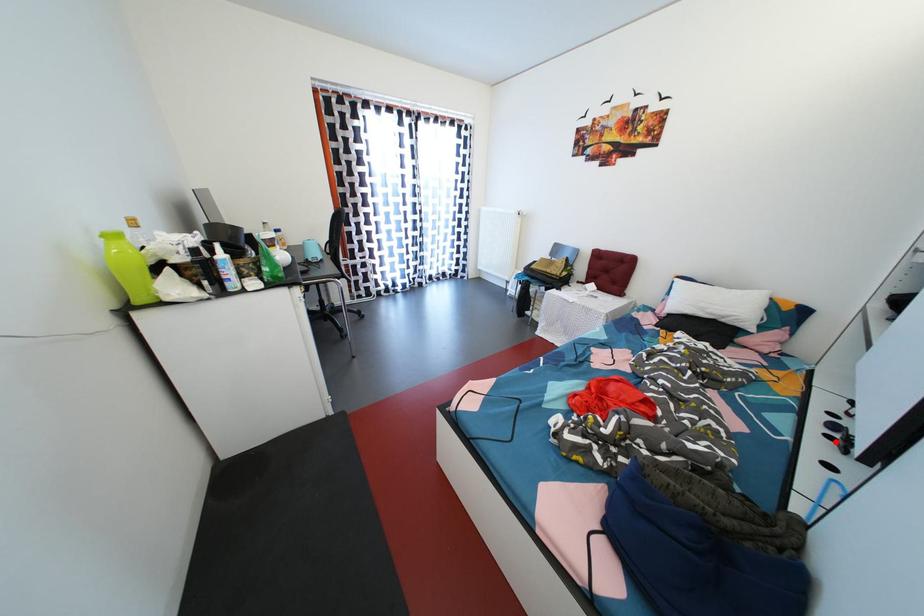
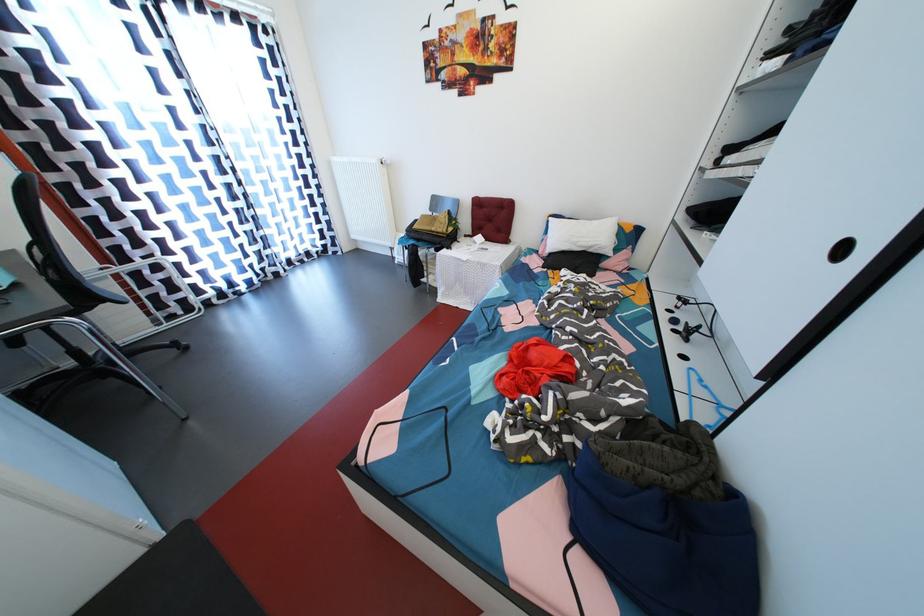
The point at the highlighted location is marked in the first image. Where is the corresponding point in the second image?

(681, 336)